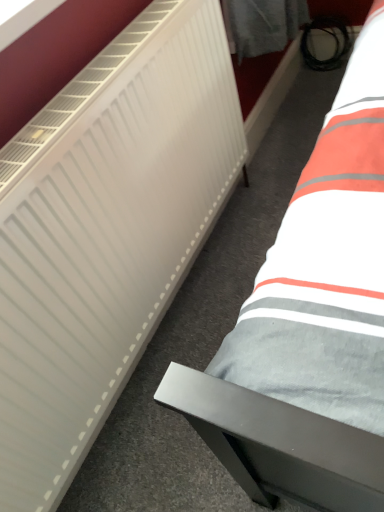
Image resolution: width=384 pixels, height=512 pixels. In order to click on vacant space to the right of white matte radiator at left in this screenshot , I will do `click(252, 230)`.